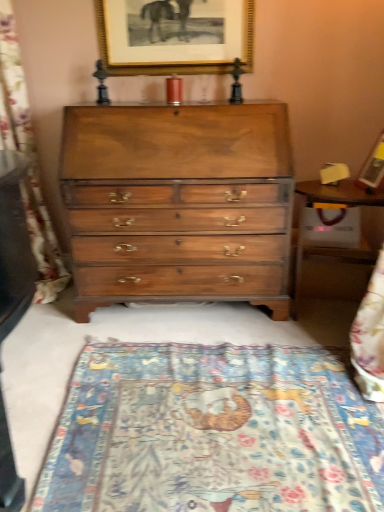
This screenshot has height=512, width=384. I want to click on free space below wooden table at right (from a real-world perspective), so click(328, 309).